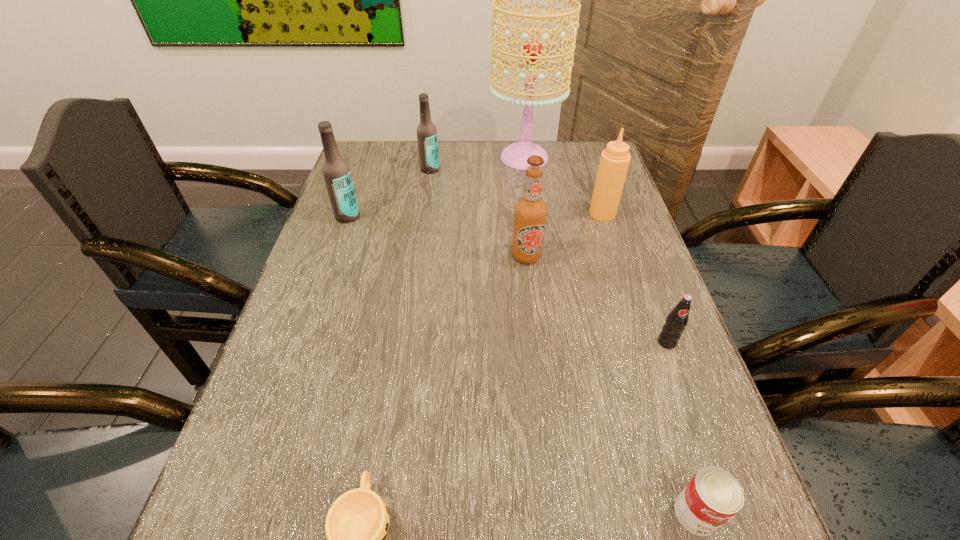
You are a GUI agent. You are given a task and a screenshot of the screen. Output one action in this format:
    pyautogui.click(x=<x>, y=<y>)
    Task: Click on the vacant space located on the right of the tallest object
    Image resolution: width=960 pixels, height=540 pixels.
    Given the screenshot: What is the action you would take?
    pyautogui.click(x=600, y=158)

Find the location of a particular element. vacant area located 0.280m on the front label of the fourth nearest object is located at coordinates (539, 363).

This screenshot has height=540, width=960. I want to click on free spot located 0.300m on the side of the leftmost beer bottle with the label, so click(316, 307).

Find the location of a particular element. The image size is (960, 540). free space located on the back of the condiment is located at coordinates (584, 154).

Where is `vacant area located on the label of the second beer bottle from left to right`? vacant area located on the label of the second beer bottle from left to right is located at coordinates (420, 231).

Locate an element on the screen. This screenshot has height=540, width=960. vacant area situated on the front label of the third nearest object is located at coordinates (691, 408).

Identify the location of lampshade situated at the far edge. The height and width of the screenshot is (540, 960). [x=515, y=155].

I want to click on beer bottle that is at the far edge, so point(427,140).

Where is `object at the near edge`? This screenshot has height=540, width=960. object at the near edge is located at coordinates (713, 496).

The height and width of the screenshot is (540, 960). Find the location of `object that is positioned at the left edge`. object that is positioned at the left edge is located at coordinates tap(336, 172).